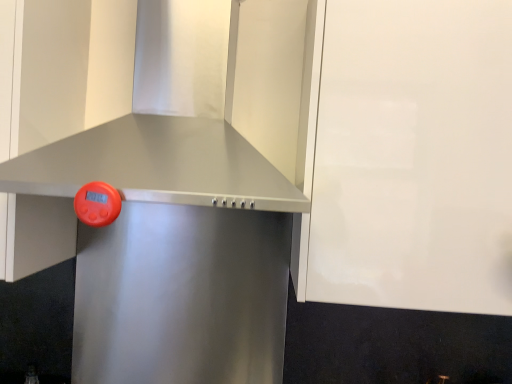
Question: From the image's perspective, does satin metallic vent at center appear lower than satin metallic range hood at center?

Choices:
 (A) yes
 (B) no

Answer: (B)

Question: Considering the relative sizes of satin metallic vent at center and satin metallic range hood at center in the image provided, is satin metallic vent at center wider than satin metallic range hood at center?

Choices:
 (A) no
 (B) yes

Answer: (B)

Question: Is satin metallic vent at center to the left of satin metallic range hood at center from the viewer's perspective?

Choices:
 (A) yes
 (B) no

Answer: (B)

Question: Considering the relative sizes of satin metallic vent at center and satin metallic range hood at center in the image provided, is satin metallic vent at center bigger than satin metallic range hood at center?

Choices:
 (A) yes
 (B) no

Answer: (A)

Question: Would you say satin metallic range hood at center is part of satin metallic vent at center's contents?

Choices:
 (A) yes
 (B) no

Answer: (B)

Question: From a real-world perspective, is satin metallic vent at center positioned under satin metallic range hood at center based on gravity?

Choices:
 (A) yes
 (B) no

Answer: (B)

Question: Considering the relative sizes of white glossy cabinet at upper right and satin metallic vent at center in the image provided, is white glossy cabinet at upper right taller than satin metallic vent at center?

Choices:
 (A) yes
 (B) no

Answer: (A)

Question: Is white glossy cabinet at upper right wider than satin metallic vent at center?

Choices:
 (A) yes
 (B) no

Answer: (B)

Question: Are white glossy cabinet at upper right and satin metallic vent at center making contact?

Choices:
 (A) no
 (B) yes

Answer: (A)

Question: Could you tell me if white glossy cabinet at upper right is turned towards satin metallic vent at center?

Choices:
 (A) yes
 (B) no

Answer: (B)

Question: Is white glossy cabinet at upper right thinner than satin metallic vent at center?

Choices:
 (A) yes
 (B) no

Answer: (A)

Question: Considering the relative positions of white glossy cabinet at upper right and satin metallic vent at center in the image provided, is white glossy cabinet at upper right to the left of satin metallic vent at center from the viewer's perspective?

Choices:
 (A) yes
 (B) no

Answer: (B)

Question: Can you confirm if satin metallic range hood at center is shorter than white glossy cabinet at upper right?

Choices:
 (A) yes
 (B) no

Answer: (A)